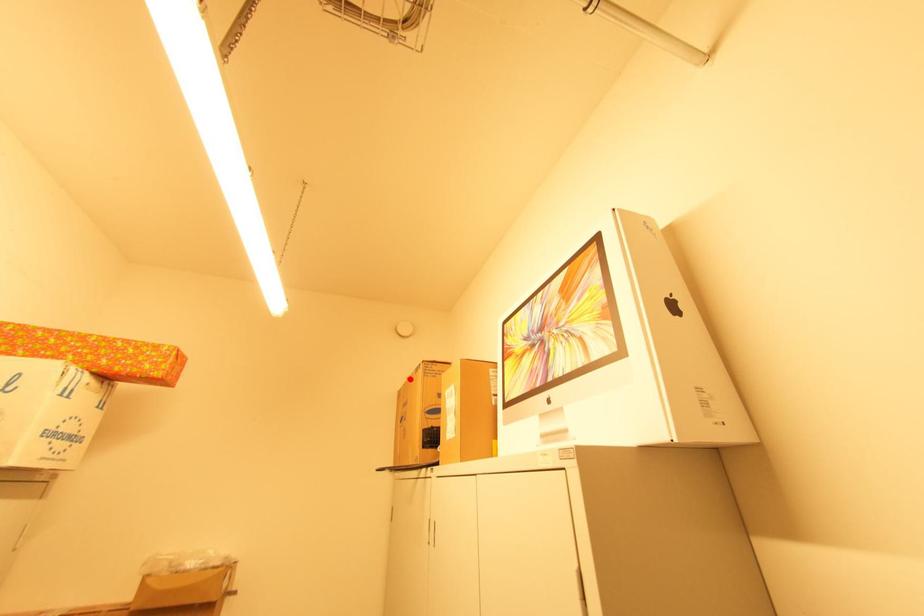
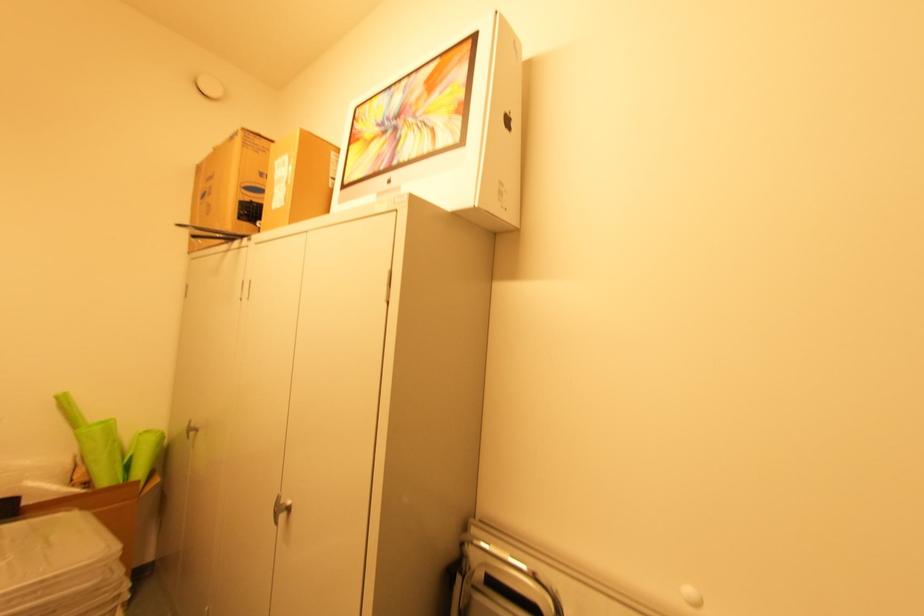
The point at the highlighted location is marked in the first image. Where is the corresponding point in the second image?

(216, 148)